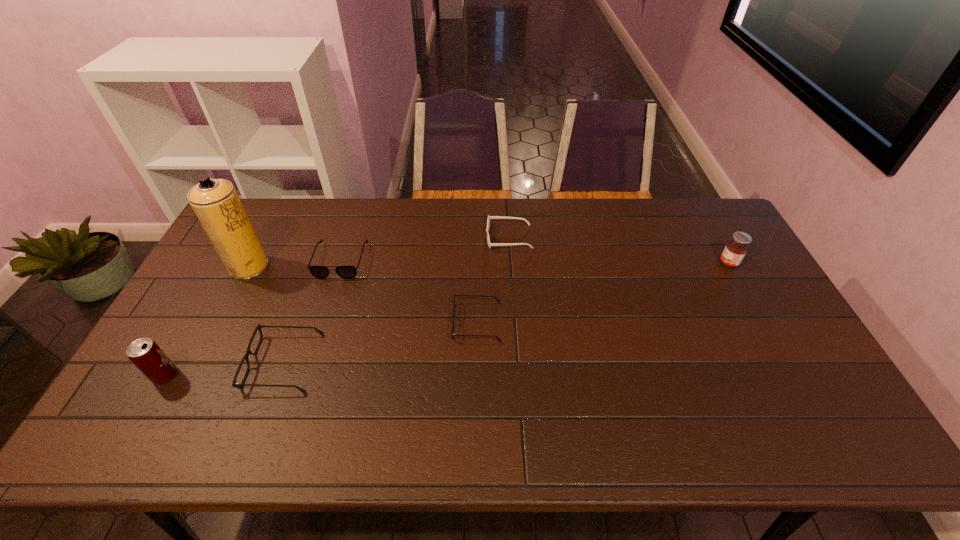
Find the location of a particular element. the shortest spectacles is located at coordinates (496, 298).

Find the location of a particular element. The height and width of the screenshot is (540, 960). the rightmost spectacles is located at coordinates (496, 298).

Locate an element on the screen. sunglasses is located at coordinates (489, 217).

This screenshot has width=960, height=540. Find the location of `the tallest object`. the tallest object is located at coordinates (215, 202).

Where is `jam`? jam is located at coordinates (735, 250).

You are a GUI agent. You are given a task and a screenshot of the screen. Output one action in this format:
    pyautogui.click(x=<x>, y=<y>)
    Task: Click on the farthest spectacles
    The height and width of the screenshot is (540, 960).
    Given the screenshot: What is the action you would take?
    pyautogui.click(x=321, y=272)

The image size is (960, 540). Find the location of `beer can`. beer can is located at coordinates (144, 353).

This screenshot has width=960, height=540. What are the coordinates of `vacant space located on the front-facing side of the shortest spectacles` in the screenshot? It's located at (432, 321).

I want to click on vacant space located on the front-facing side of the shortest spectacles, so click(x=428, y=321).

The image size is (960, 540). In order to click on free space located on the front-facing side of the shortest spectacles in this screenshot , I will do `click(338, 321)`.